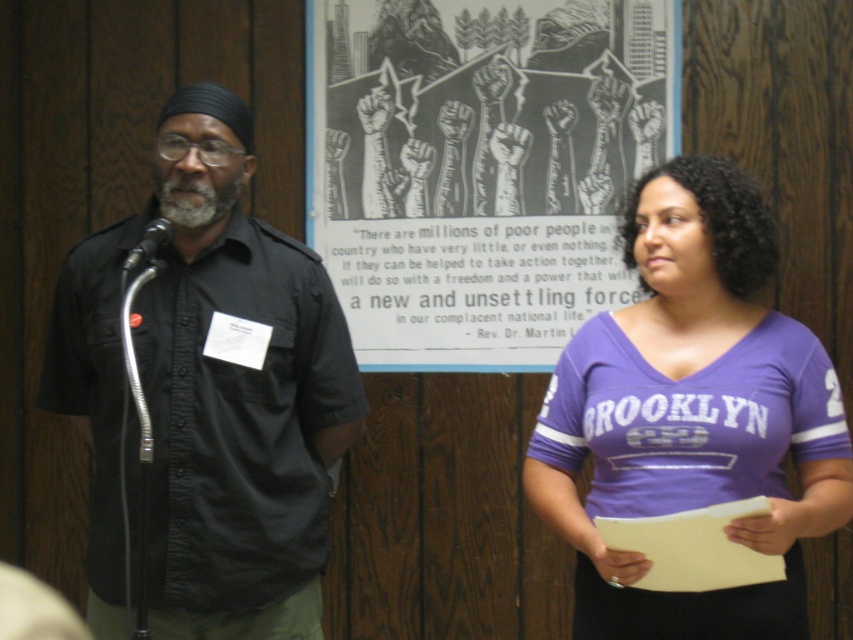
You are organizing a photo shoot and need to ensure that the black matte shirt at center and the purple jersey at center are visible in the frame. Given their sizes, which one might require more space in the composition?

The purple jersey at center requires more space in the composition because it is larger than the black matte shirt at center.

What is located at the coordinates point (480,166) in the image?

The point (480,166) indicates black and white print at center.